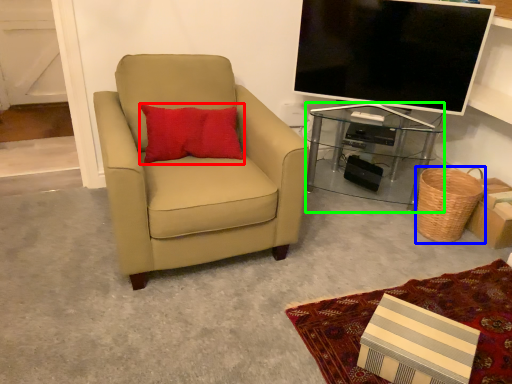
Question: Considering the real-world distances, which object is closest to pillow (highlighted by a red box)? basket (highlighted by a blue box) or desk (highlighted by a green box).

Choices:
 (A) basket
 (B) desk

Answer: (B)